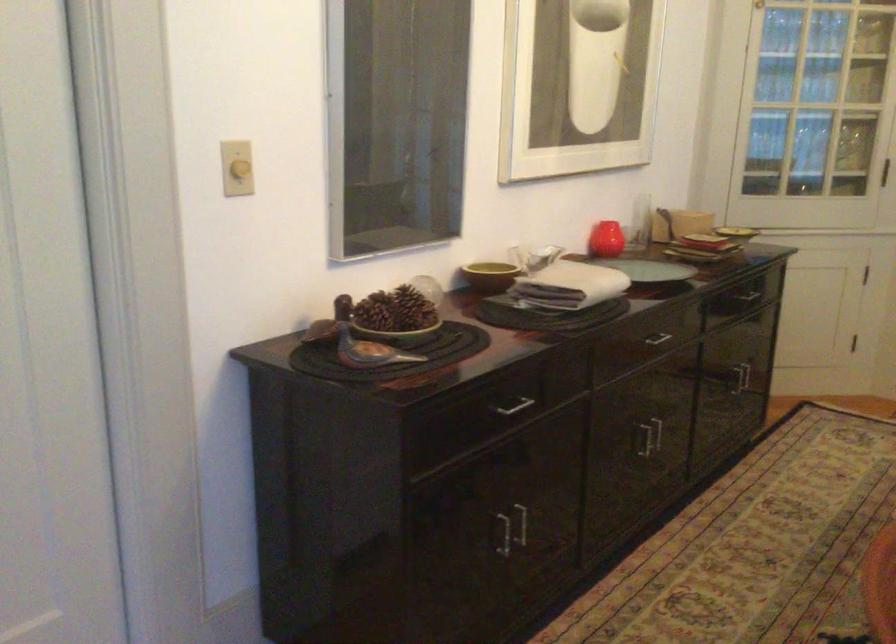
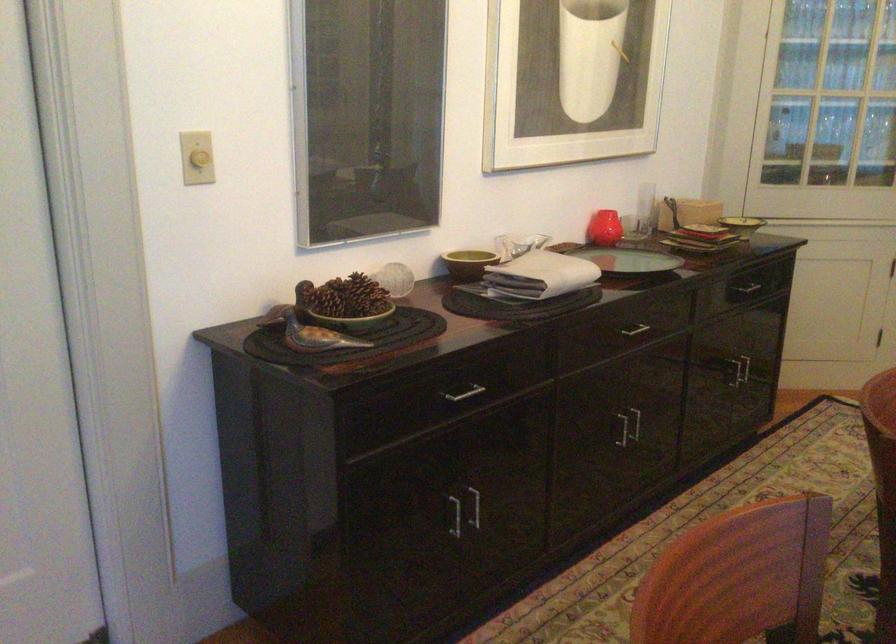
In the second image, find the point that corresponds to point (657, 339) in the first image.

(634, 328)